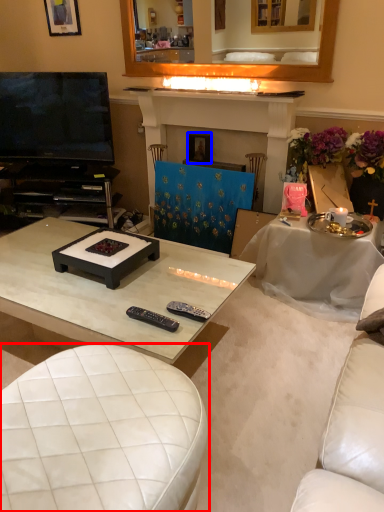
Question: Which of the following is the closest to the observer, studio couch (highlighted by a red box) or picture frame (highlighted by a blue box)?

Choices:
 (A) studio couch
 (B) picture frame

Answer: (A)